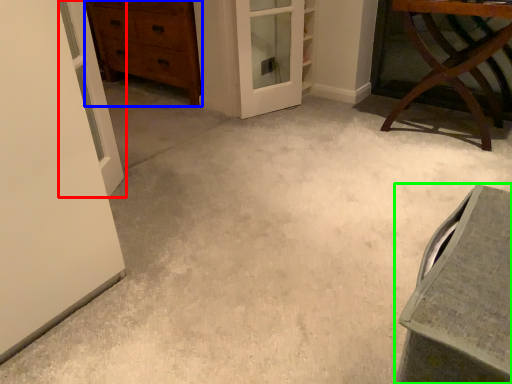
Question: Which is farther away from door (highlighted by a red box)? chest of drawers (highlighted by a blue box) or vanity (highlighted by a green box)?

Choices:
 (A) chest of drawers
 (B) vanity

Answer: (A)